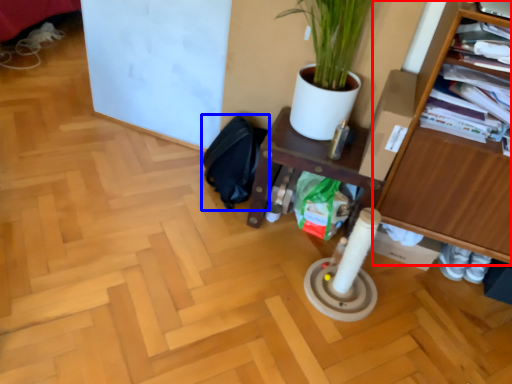
Question: Which object appears closest to the camera in this image, furniture (highlighted by a red box) or swivel chair (highlighted by a blue box)?

Choices:
 (A) furniture
 (B) swivel chair

Answer: (A)